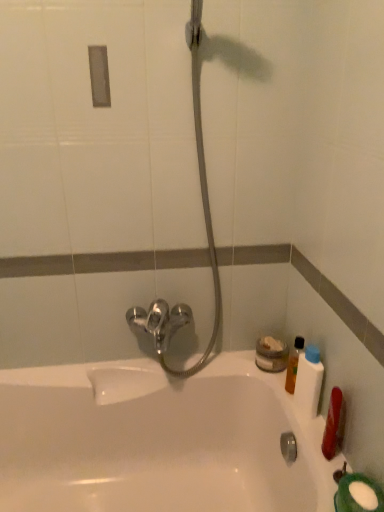
You are a GUI agent. You are given a task and a screenshot of the screen. Output one action in this format:
    pyautogui.click(x=<x>, y=<y>)
    Task: Click on the free point in front of white plastic bottle at right, arranged as the 1th mouthwash when viewed from the front
    Image resolution: width=384 pixels, height=512 pixels.
    Given the screenshot: What is the action you would take?
    pyautogui.click(x=312, y=442)